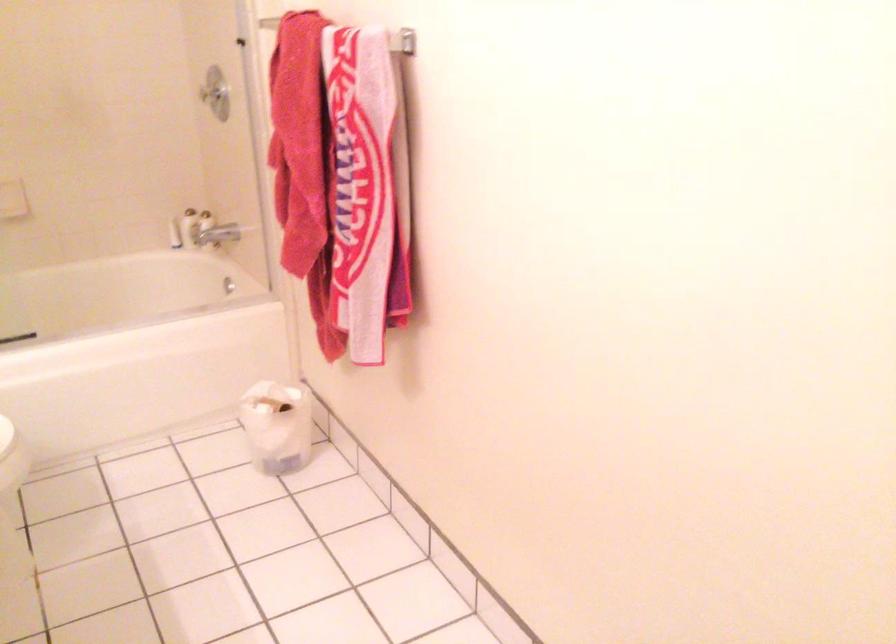
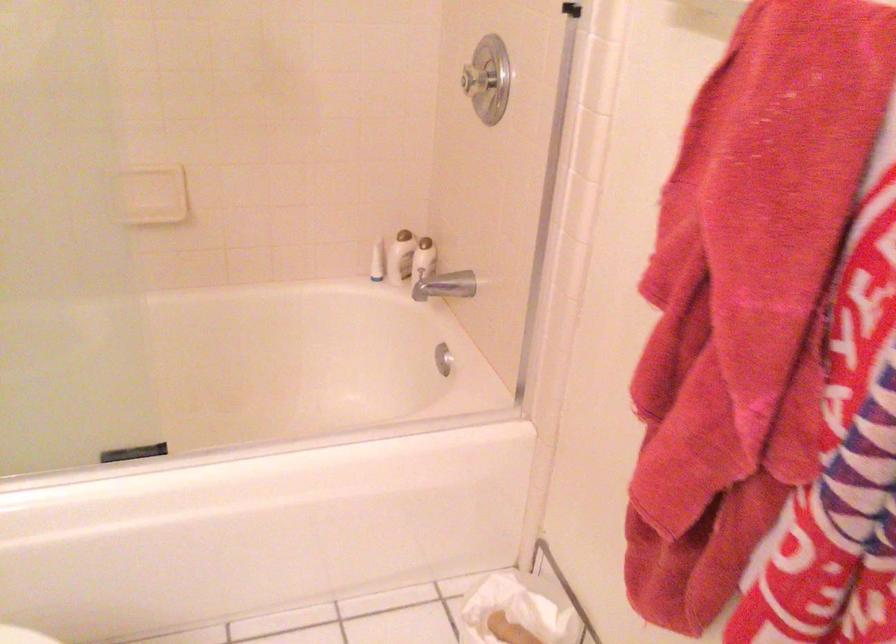
What movement of the cameraman would produce the second image?

The cameraman moved toward left, forward.